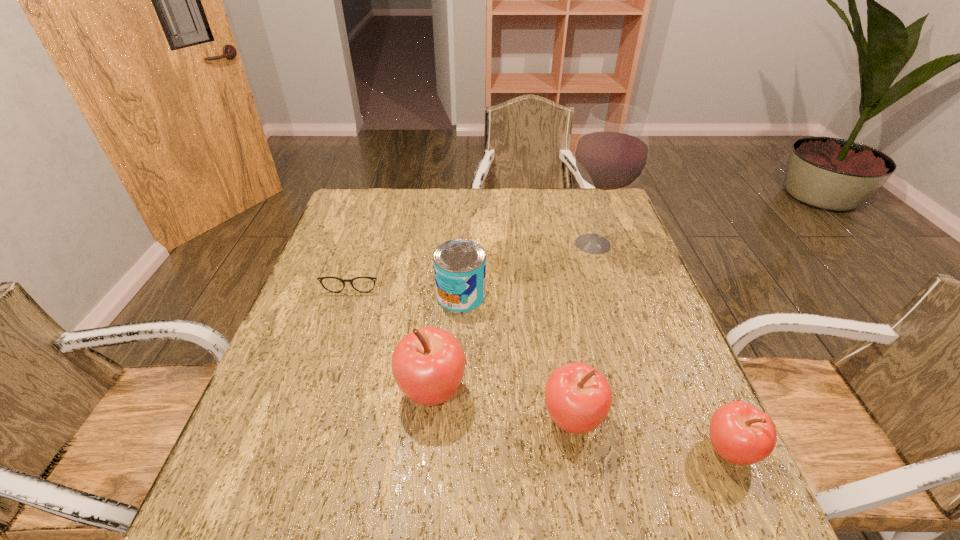
Find the location of a particular element. This screenshot has width=960, height=540. the leftmost apple is located at coordinates (428, 364).

Find the location of a particular element. the second shortest apple is located at coordinates (578, 397).

Where is `the rightmost apple`? The width and height of the screenshot is (960, 540). the rightmost apple is located at coordinates coord(740,433).

Where is `the tallest object`? This screenshot has height=540, width=960. the tallest object is located at coordinates 611,154.

The height and width of the screenshot is (540, 960). I want to click on can, so click(459, 265).

Image resolution: width=960 pixels, height=540 pixels. In order to click on the leftmost object in this screenshot , I will do `click(332, 284)`.

Where is `the shortest object`? the shortest object is located at coordinates (332, 284).

This screenshot has height=540, width=960. I want to click on vacant position located 0.370m on the back of the leftmost apple, so click(x=444, y=260).

The image size is (960, 540). Find the location of `free location located 0.240m on the back of the second apple from left to right`. free location located 0.240m on the back of the second apple from left to right is located at coordinates (553, 311).

Image resolution: width=960 pixels, height=540 pixels. I want to click on vacant space located 0.320m on the left of the rightmost apple, so click(532, 450).